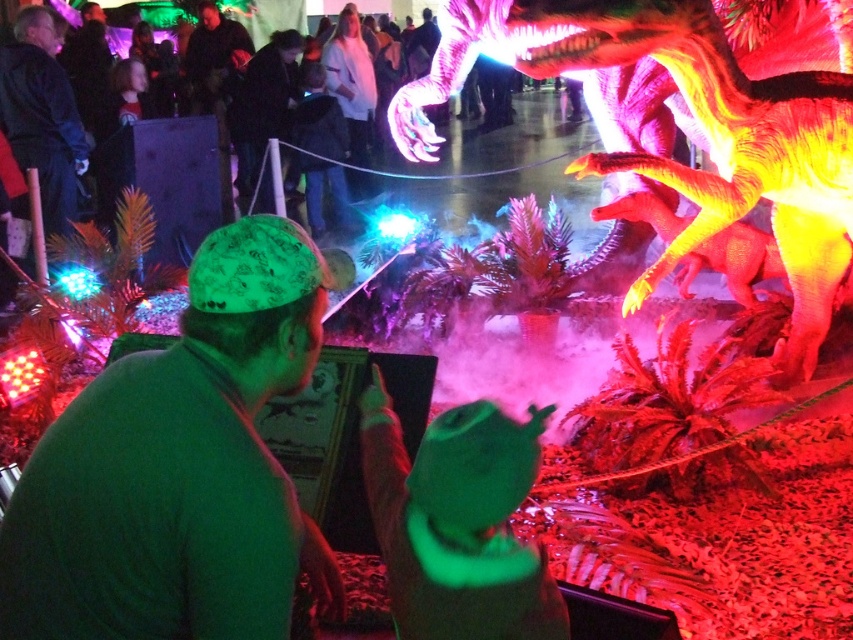
Question: Is green fabric cap at center closer to camera compared to dark gray fabric jacket at center?

Choices:
 (A) no
 (B) yes

Answer: (B)

Question: Which point is farther to the camera?

Choices:
 (A) 292,531
 (B) 260,58
 (C) 598,13

Answer: (B)

Question: Which object is positioned farthest from the green fabric cap at center?

Choices:
 (A) dark gray fabric jacket at center
 (B) shiny plastic dinosaur at center

Answer: (A)

Question: Is green fabric cap at center to the left of shiny plastic dinosaur at center from the viewer's perspective?

Choices:
 (A) yes
 (B) no

Answer: (A)

Question: Can you confirm if green fabric cap at center is wider than dark gray fabric jacket at center?

Choices:
 (A) yes
 (B) no

Answer: (B)

Question: Which point is closer to the camera?

Choices:
 (A) (625, 35)
 (B) (233, 138)
 (C) (252, 616)

Answer: (C)